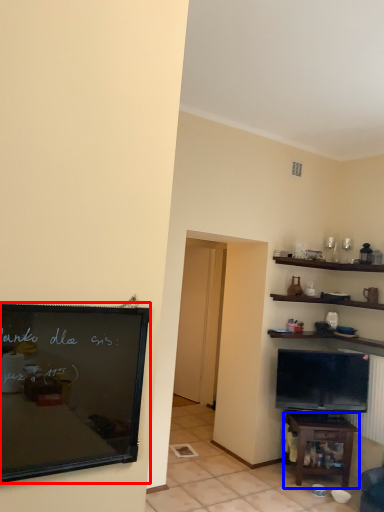
Question: Which point is further to the camera, bulletin board (highlighted by a red box) or table (highlighted by a blue box)?

Choices:
 (A) bulletin board
 (B) table

Answer: (B)